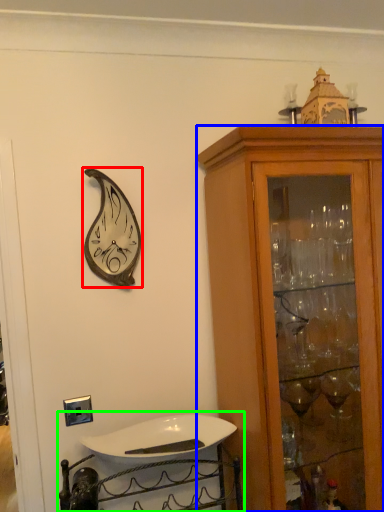
Question: Estimate the real-world distances between objects in this image. Which object is farther from clock (highlighted by a red box), cabinetry (highlighted by a blue box) or sink (highlighted by a green box)?

Choices:
 (A) cabinetry
 (B) sink

Answer: (B)